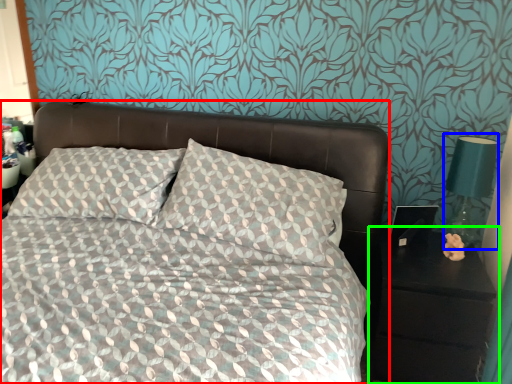
Question: Which is nearer to the bed (highlighted by a red box)? bedside lamp (highlighted by a blue box) or nightstand (highlighted by a green box).

Choices:
 (A) bedside lamp
 (B) nightstand

Answer: (B)